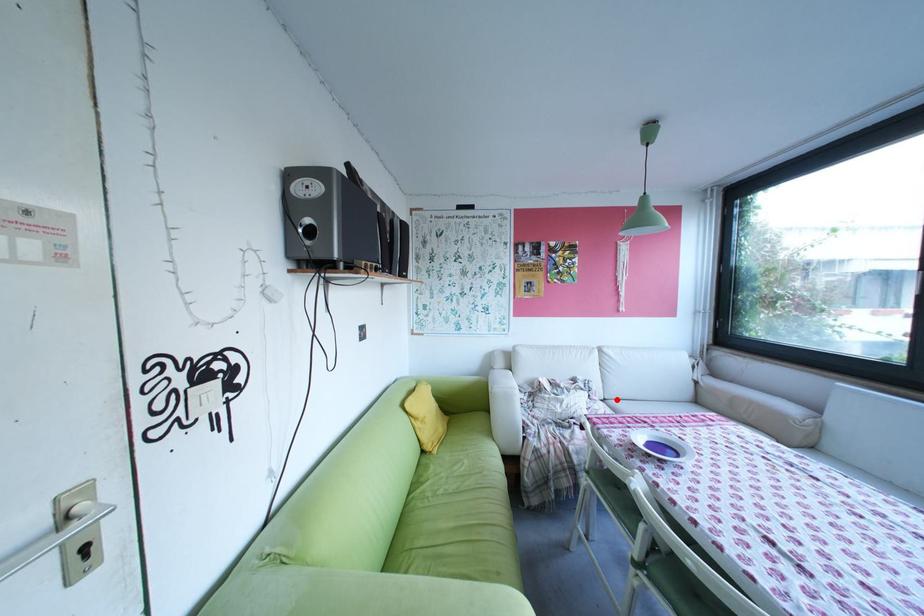
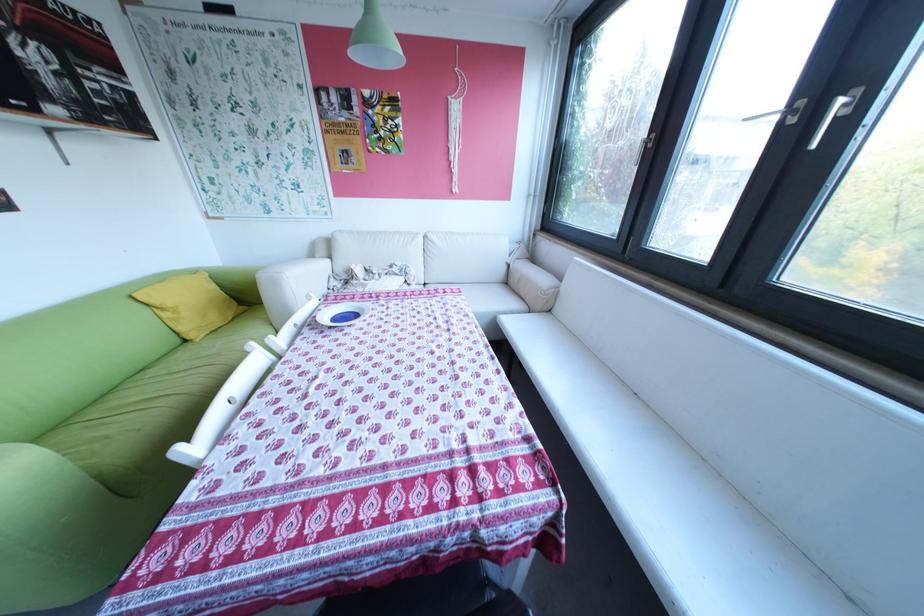
Find the pixel in the second image that matches the highlighted location in the first image.

(438, 284)